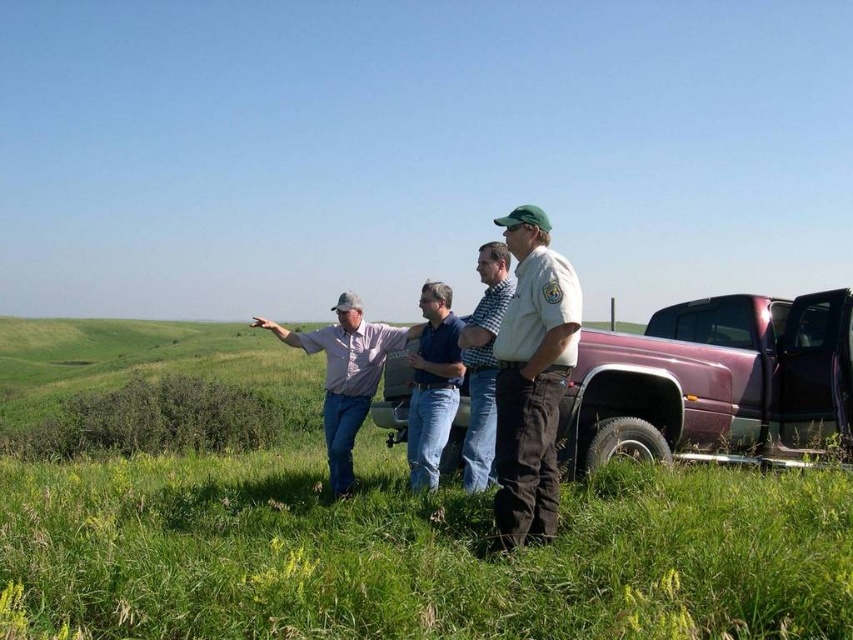
Question: Where is green grassy at lower center located in relation to checkered shirt at center in the image?

Choices:
 (A) below
 (B) above

Answer: (A)

Question: Does white uniform at center have a larger size compared to light brown shirt at center?

Choices:
 (A) no
 (B) yes

Answer: (A)

Question: Is white uniform at center below checkered shirt at center?

Choices:
 (A) yes
 (B) no

Answer: (B)

Question: Which is nearer to the white uniform at center?

Choices:
 (A) light brown shirt at center
 (B) green grassy at lower center
 (C) blue denim jeans at center

Answer: (B)

Question: Which object is farther from the camera taking this photo?

Choices:
 (A) pink metallic truck at center
 (B) blue denim jeans at center

Answer: (B)

Question: Estimate the real-world distances between objects in this image. Which object is closer to the white uniform at center?

Choices:
 (A) checkered shirt at center
 (B) blue denim jeans at center
 (C) green grassy at lower center
 (D) light brown shirt at center

Answer: (A)